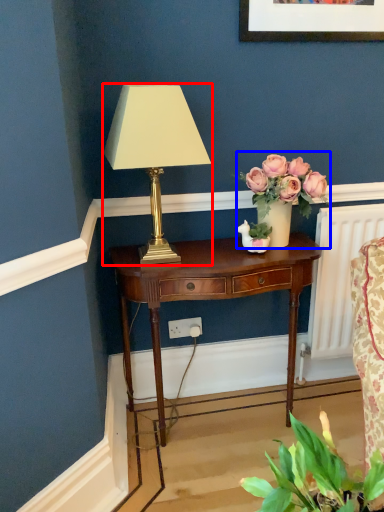
Question: Which point is further to the camera, lamp (highlighted by a red box) or floral arrangement (highlighted by a blue box)?

Choices:
 (A) lamp
 (B) floral arrangement

Answer: (B)